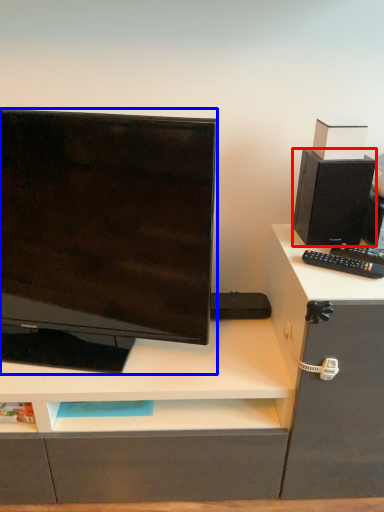
Question: Which of the following is the closest to the observer, speaker (highlighted by a red box) or computer monitor (highlighted by a blue box)?

Choices:
 (A) speaker
 (B) computer monitor

Answer: (B)